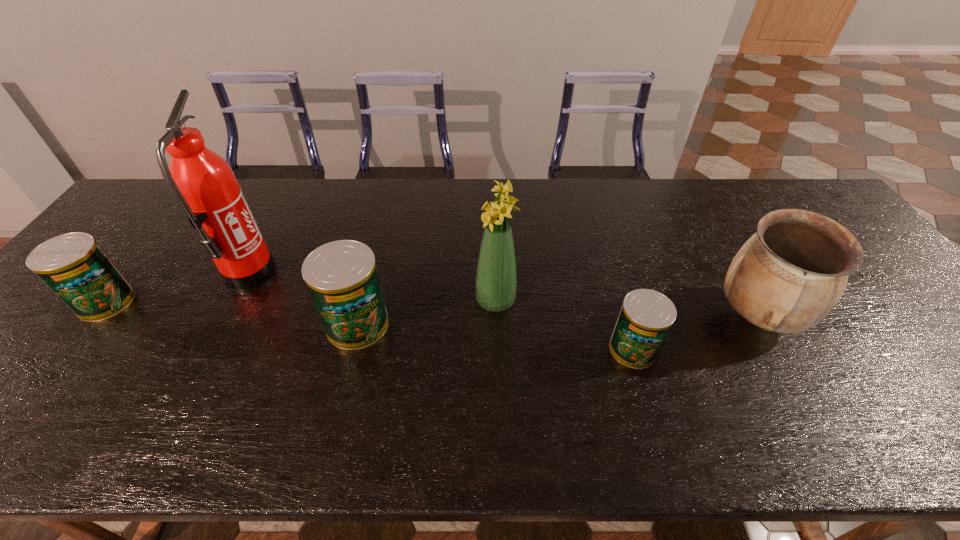
Find the location of a particular element. object present at the left edge is located at coordinates tap(76, 269).

In the image, there is a desktop. Where is `vacant space at the far edge`? Image resolution: width=960 pixels, height=540 pixels. vacant space at the far edge is located at coordinates (570, 179).

Image resolution: width=960 pixels, height=540 pixels. I want to click on vacant space at the near edge of the desktop, so click(501, 385).

In the image, there is a desktop. Where is `free space at the right edge`? The image size is (960, 540). free space at the right edge is located at coordinates (883, 348).

In order to click on vacant space that is in between the shortest object and the fourth object from left to right in this screenshot , I will do pos(564,325).

In order to click on vacant area that lies between the fourth object from left to right and the second can from left to right in this screenshot , I will do click(426, 313).

Where is `unoccupied position between the second can from left to right and the second object from right to left`? unoccupied position between the second can from left to right and the second object from right to left is located at coordinates (495, 336).

This screenshot has height=540, width=960. What are the coordinates of `unoccupied area between the fifth tallest object and the fourth object from right to left` in the screenshot? It's located at (232, 313).

You are a GUI agent. You are given a task and a screenshot of the screen. Output one action in this format:
    pyautogui.click(x=<x>, y=<y>)
    Task: Click on the unoccupied position between the rightmost object and the leftmost can
    The width and height of the screenshot is (960, 540).
    Given the screenshot: What is the action you would take?
    pyautogui.click(x=432, y=309)

Locate an element on the screen. vacant space that is in between the fifth tallest object and the second can from left to right is located at coordinates (232, 313).